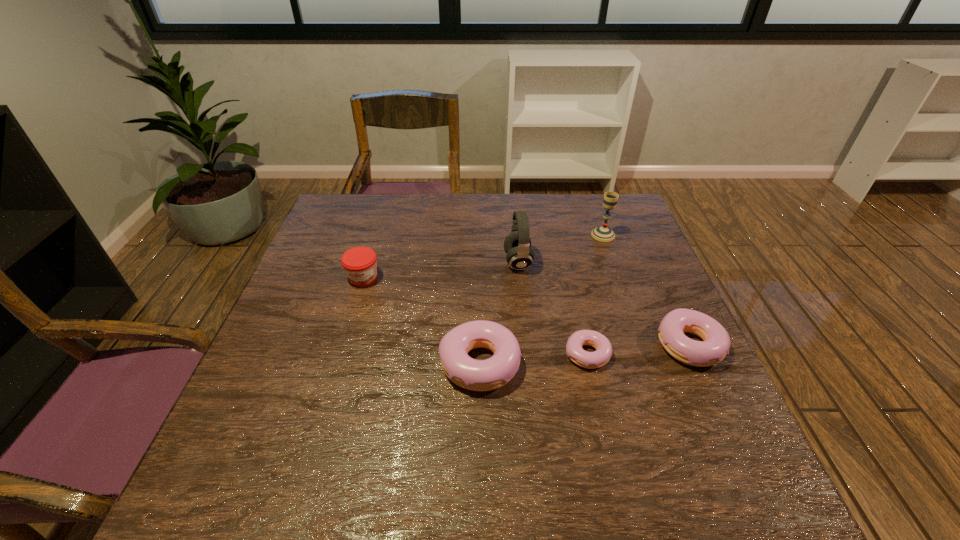
Locate an element on the screen. vacant region located on the back of the second shortest object is located at coordinates pos(664,290).

Locate an element on the screen. Image resolution: width=960 pixels, height=540 pixels. blank space located 0.200m on the label side of the jam is located at coordinates point(342,350).

Identify the location of vacant space located on the front of the chalice. The height and width of the screenshot is (540, 960). (610, 252).

Identify the location of free space located on the ear cups of the headset. (439, 262).

I want to click on free space located on the ear cups of the headset, so click(x=428, y=262).

Find the location of `vacant space located 0.120m on the ear cups of the headset`. vacant space located 0.120m on the ear cups of the headset is located at coordinates (461, 262).

Find the location of a particular element. object located at the far edge is located at coordinates (603, 233).

Locate an element on the screen. The height and width of the screenshot is (540, 960). object positioned at the left edge is located at coordinates (359, 263).

What are the coordinates of `doughnut located at the right edge` in the screenshot? It's located at (715, 346).

Find the location of a particular element. The height and width of the screenshot is (540, 960). chalice that is at the right edge is located at coordinates (603, 233).